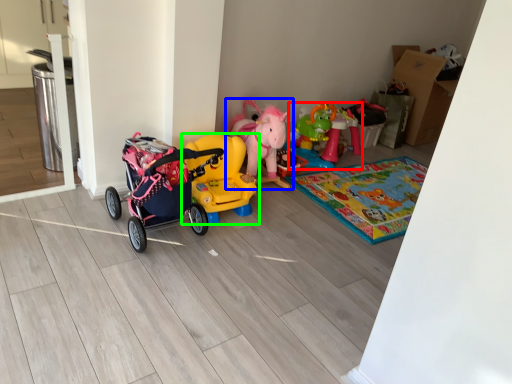
Question: Which is farther away from toy (highlighted by a red box)? toy (highlighted by a blue box) or toy (highlighted by a green box)?

Choices:
 (A) toy
 (B) toy

Answer: (B)